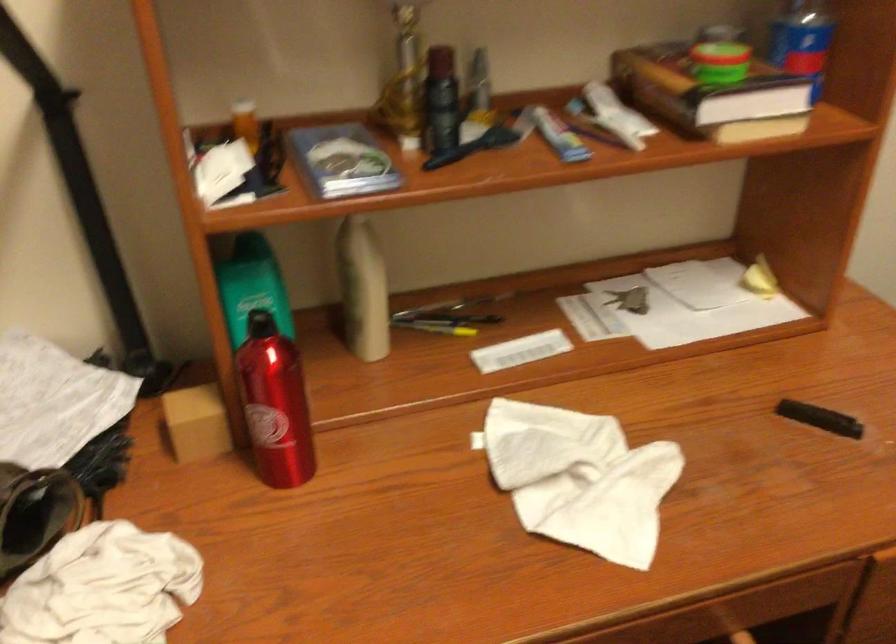
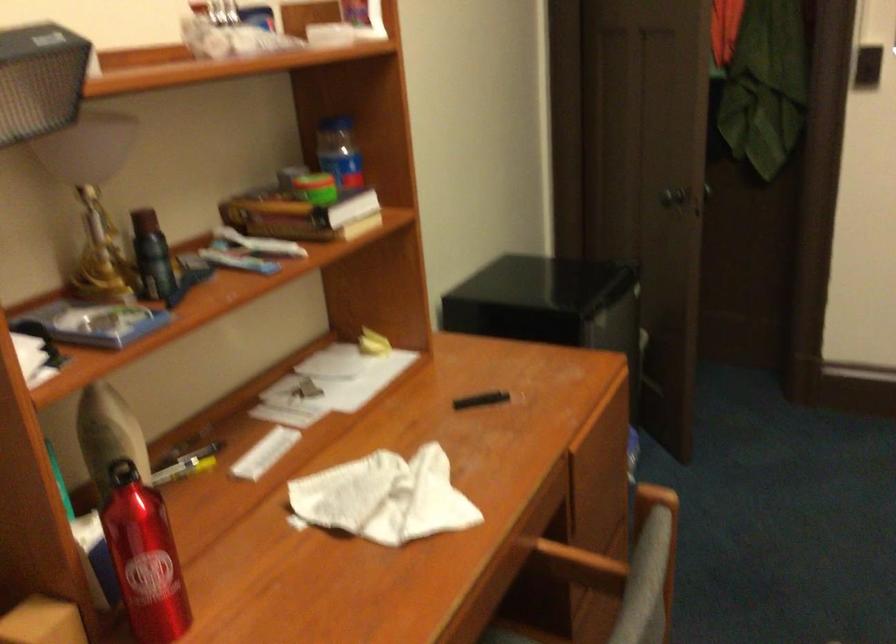
Find the pixel in the second image that matches pixel 555 477 in the first image.

(383, 498)